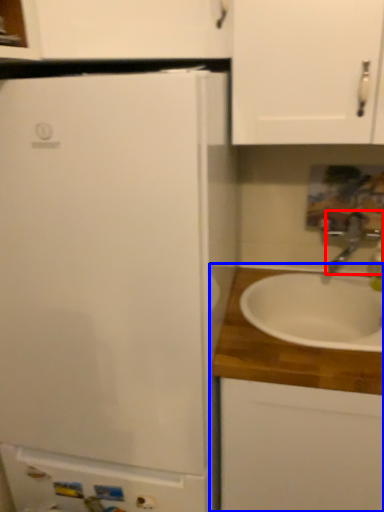
Question: Among these objects, which one is farthest to the camera, tap (highlighted by a red box) or cabinetry (highlighted by a blue box)?

Choices:
 (A) tap
 (B) cabinetry

Answer: (A)